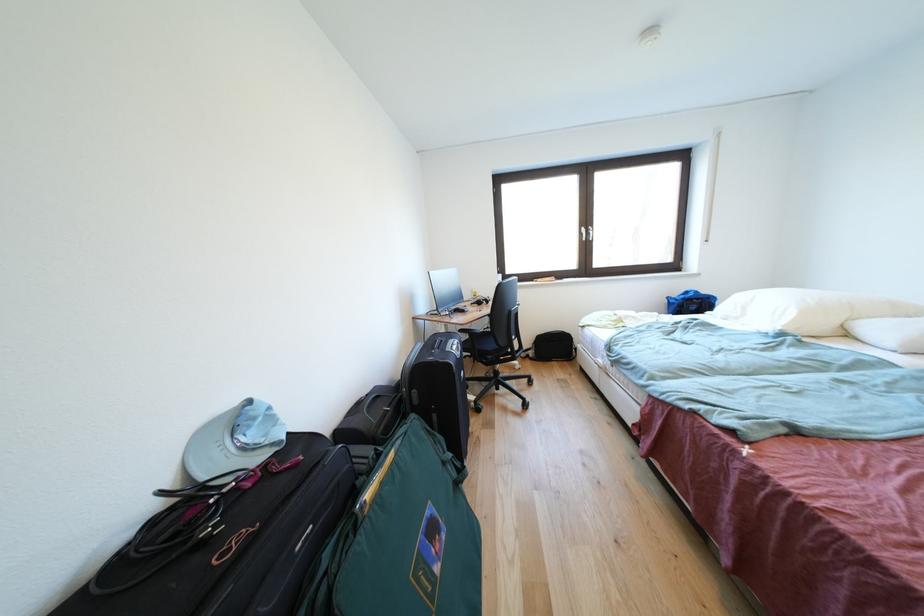
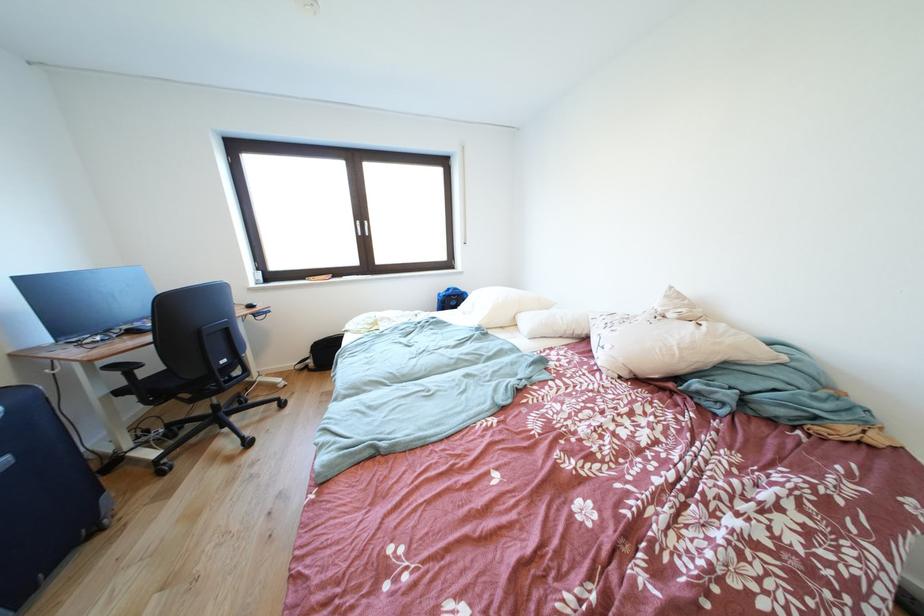
Where in the second image is the point corresponding to point (469, 334) from the first image?

(120, 371)